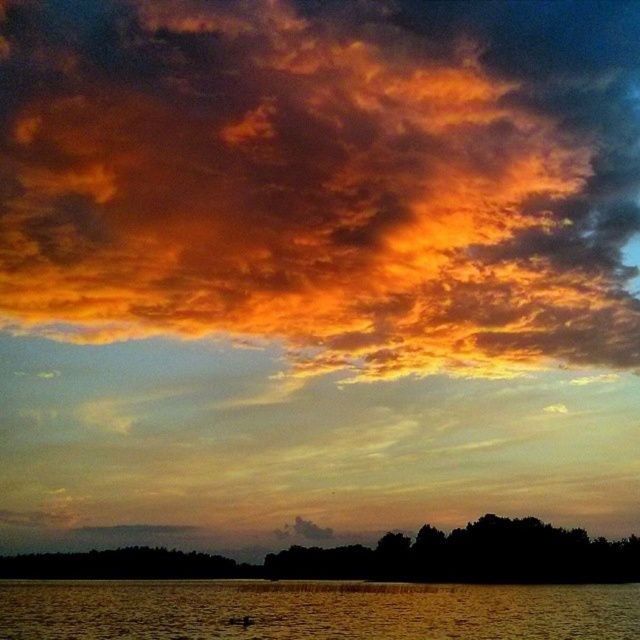
Question: Which object appears farthest from the camera in this image?

Choices:
 (A) fiery cotton clouds at upper center
 (B) golden reflective water at lower center

Answer: (A)

Question: Which of the following is the farthest from the observer?

Choices:
 (A) fiery cotton clouds at upper center
 (B) golden reflective water at lower center

Answer: (A)

Question: Which point is closer to the camera?

Choices:
 (A) (515, 97)
 (B) (531, 604)

Answer: (B)

Question: In this image, where is fiery cotton clouds at upper center located relative to golden reflective water at lower center?

Choices:
 (A) above
 (B) below

Answer: (A)

Question: Is fiery cotton clouds at upper center positioned at the back of golden reflective water at lower center?

Choices:
 (A) no
 (B) yes

Answer: (B)

Question: Can you confirm if fiery cotton clouds at upper center is positioned above golden reflective water at lower center?

Choices:
 (A) yes
 (B) no

Answer: (A)